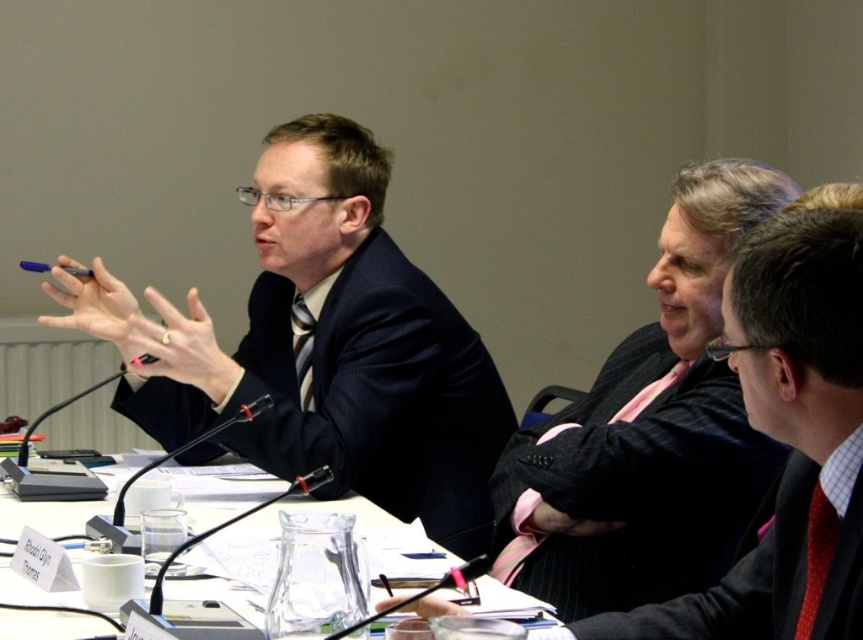
Between black pinstripe suit at right and clear glass table at center, which one has more height?

black pinstripe suit at right is taller.

Who is positioned more to the right, black pinstripe suit at right or clear glass table at center?

Positioned to the right is black pinstripe suit at right.

Find the location of a particular element. black pinstripe suit at right is located at coordinates (772, 570).

Is matte black suit at left to the right of black pinstripe suit at right from the viewer's perspective?

No, matte black suit at left is not to the right of black pinstripe suit at right.

Consider the image. Can you confirm if matte black suit at left is positioned above black pinstripe suit at right?

Indeed, matte black suit at left is positioned over black pinstripe suit at right.

The width and height of the screenshot is (863, 640). Describe the element at coordinates (358, 397) in the screenshot. I see `matte black suit at left` at that location.

At what (x,y) coordinates should I click in order to perform the action: click on matte black suit at left. Please return your answer as a coordinate pair (x, y). The width and height of the screenshot is (863, 640). Looking at the image, I should click on point(358,397).

Which is behind, point (405, 481) or point (666, 525)?

Point (405, 481)

Which is below, matte black suit at left or pink striped tie at center?

pink striped tie at center is below.

Describe the element at coordinates (358, 397) in the screenshot. I see `matte black suit at left` at that location.

Where is `matte black suit at left`? The height and width of the screenshot is (640, 863). matte black suit at left is located at coordinates coord(358,397).